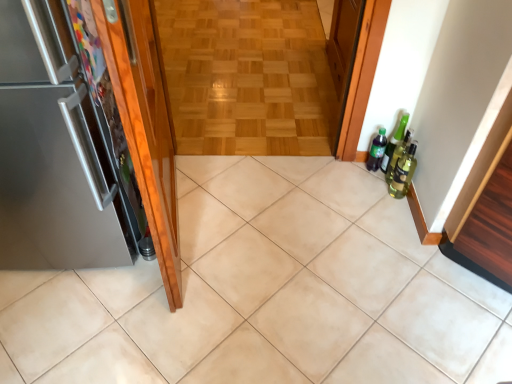
Identify the location of free area in between shiny wood door at left, the second door from the left, and green glass beer bottle at right, which is counted as the 2th beer bottle, starting from the front. The image size is (512, 384). (270, 205).